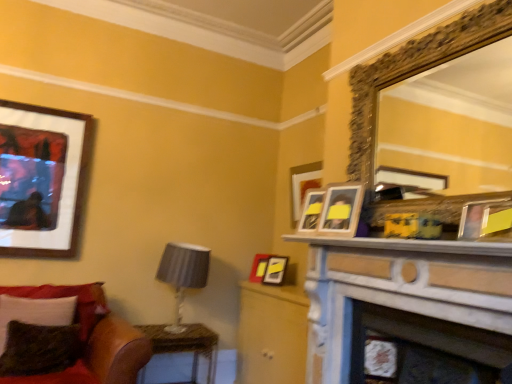
You are a GUI agent. You are given a task and a screenshot of the screen. Output one action in this format:
    pyautogui.click(x=<x>, y=<y>)
    Task: Click on the blank space situated above gold ornate mirror at upper right (from a real-world perspective)
    
    Given the screenshot: What is the action you would take?
    pyautogui.click(x=430, y=24)